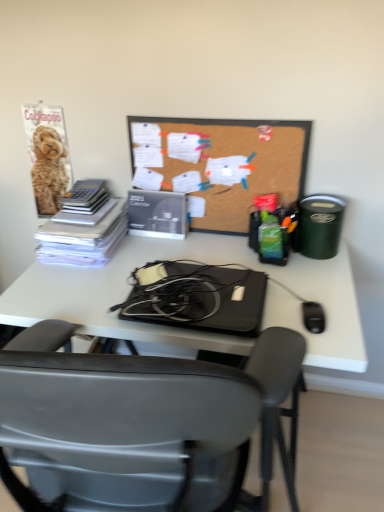
The height and width of the screenshot is (512, 384). Identify the location of vacant space in front of black plastic mouse at lower right. (332, 345).